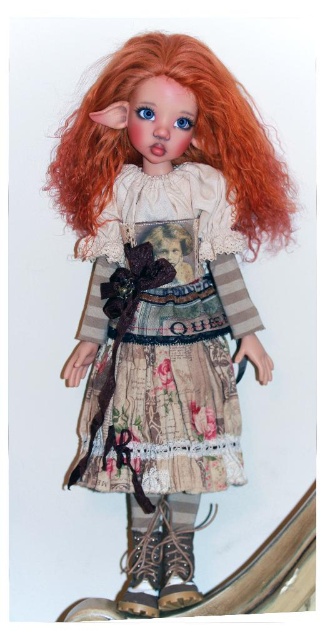
Question: Observing the image, what is the correct spatial positioning of matte cream fabric dress at center in reference to textured beige dress at center?

Choices:
 (A) above
 (B) below

Answer: (A)

Question: From the image, what is the correct spatial relationship of matte cream fabric dress at center in relation to vivid orange hair at center?

Choices:
 (A) below
 (B) above

Answer: (A)

Question: In this image, where is vivid orange hair at center located relative to leather boot at lower center?

Choices:
 (A) right
 (B) left

Answer: (A)

Question: Estimate the real-world distances between objects in this image. Which object is closer to the matte cream fabric dress at center?

Choices:
 (A) textured beige dress at center
 (B) leather boot at lower center
 (C) vivid orange hair at center

Answer: (A)

Question: Among these points, which one is nearest to the camera?

Choices:
 (A) (231, 237)
 (B) (167, 435)
 (C) (133, 538)

Answer: (B)

Question: Among these objects, which one is farthest from the camera?

Choices:
 (A) leather boot at lower center
 (B) textured beige dress at center
 (C) vivid orange hair at center
 (D) matte cream fabric dress at center

Answer: (B)